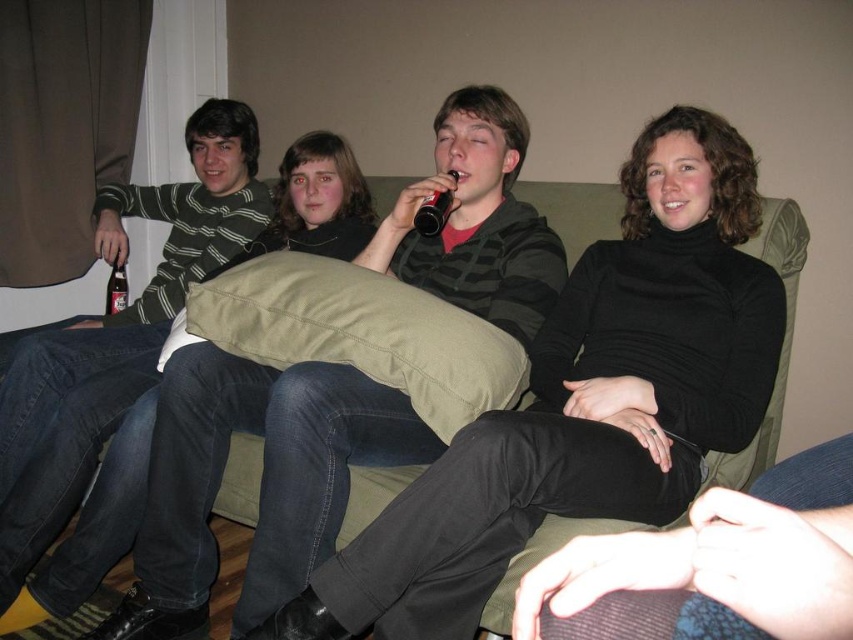
In the living room scene, there are four people sitting on a green couch. The individuals include someone in a striped long sleeve shirt and jeans holding a bottle, another in a dark top and jeans with crossed legs, a third in a striped hoodie over a red shirt, and a fourth wearing a matte black jacket. Which of these individuals is exactly at the coordinate point (x=260, y=483)?

The matte black jacket at center is located at point (x=260, y=483).

You are standing in the living room and want to place a small plant between the two points, point (x=405, y=397) and point (x=109, y=307). Which point should the plant be closer to so it is positioned in front of the other point?

The plant should be closer to point (x=405, y=397) because it is in front of point (x=109, y=307).